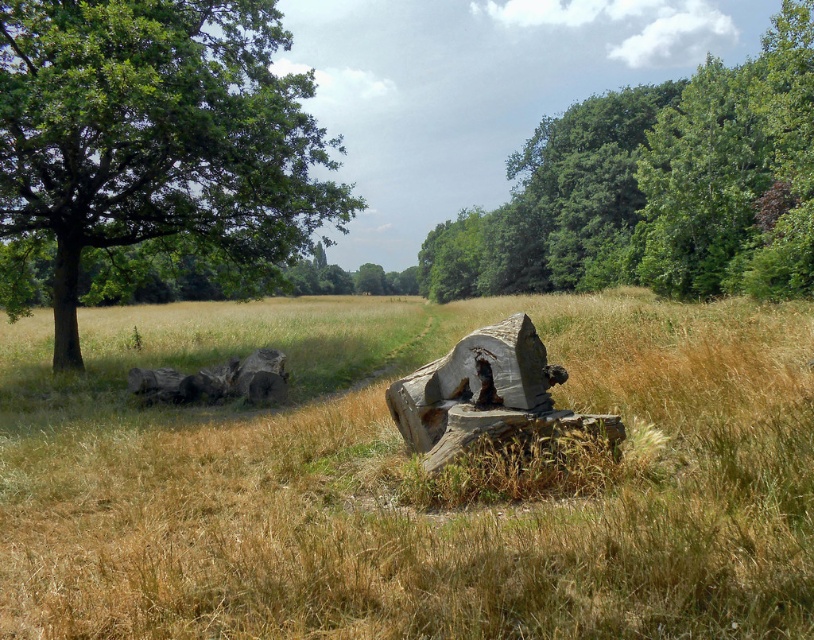
Question: Which point is farther from the camera taking this photo?

Choices:
 (A) (98, 64)
 (B) (431, 420)

Answer: (A)

Question: Which of the following is the farthest from the observer?

Choices:
 (A) brown dry grass at center
 (B) weathered wood stump at center

Answer: (B)

Question: Which point is closer to the camera?

Choices:
 (A) brown dry grass at center
 (B) green rough bark tree at left
 (C) green leafy tree at upper center

Answer: (A)

Question: Where is brown dry grass at center located in relation to brown rough tree trunk at left in the image?

Choices:
 (A) right
 (B) left

Answer: (A)

Question: Is brown dry grass at center positioned behind green rough bark tree at left?

Choices:
 (A) no
 (B) yes

Answer: (A)

Question: Can you confirm if green rough bark tree at left is positioned below weathered wood stump at center?

Choices:
 (A) no
 (B) yes

Answer: (A)